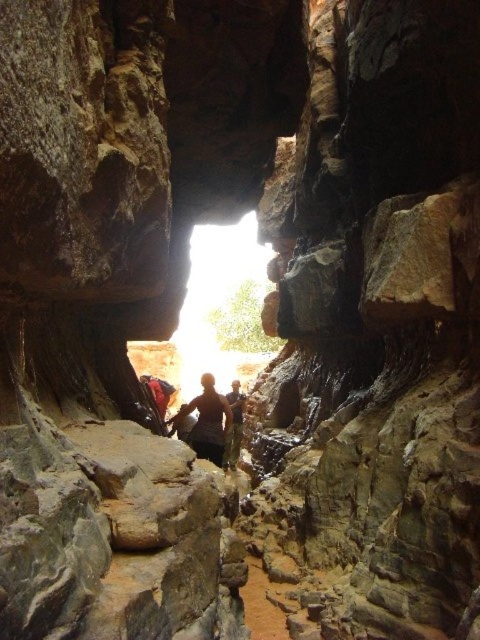
You are standing in the canyon and see a point at coordinates [206,420]. According to the scene description, what object is located at that point?

The point at coordinates [206,420] is located on the dark brown leather jacket at center.

You are standing in a narrow canyon with a natural archway at the opening. You see a dark brown leather jacket at center. Where is the dark brown leather jacket located in relation to the canyon opening?

The dark brown leather jacket at center is located at point (206, 420), which is near the center of the canyon opening.

You are a hiker preparing to exit the narrow canyon through the archway. You have a dark brown leather jacket at center and camouflage pants at center. Which item can you fold more easily to fit into your backpack?

The dark brown leather jacket at center is thinner than the camouflage pants at center, so it can be folded more easily to fit into your backpack.